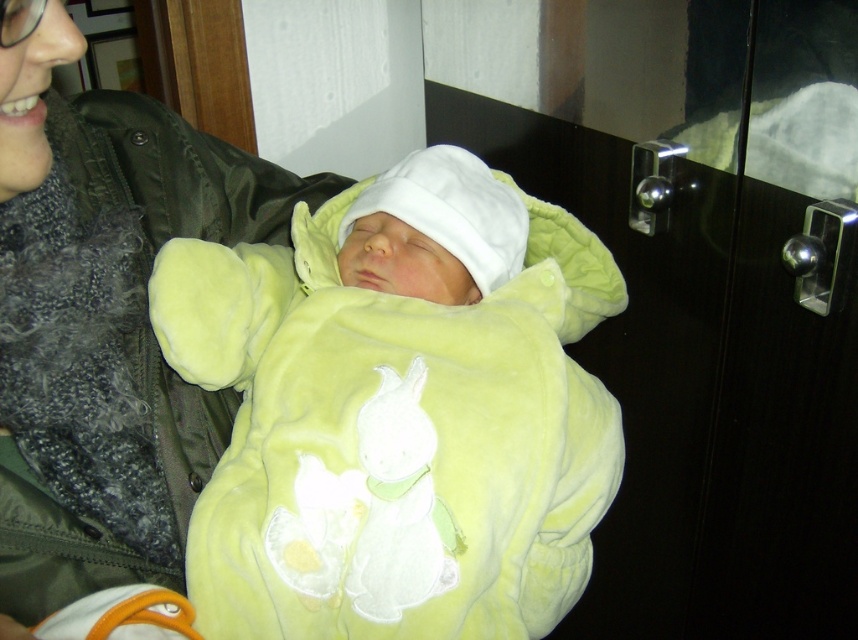
You are a photographer trying to capture a close shot of the baby in the image. Since the velvety yellow onesie at center and the velvet green jacket at upper left are both in the frame, which one should you focus on to ensure the baby is the main subject?

The velvety yellow onesie at center is positioned on the right side of the velvet green jacket at upper left, so focusing on the velvety yellow onesie at center would ensure the baby is the main subject since it is centered and closer to the baby.

You are a photographer trying to capture a close shot of the baby in the velvety yellow onesie at center and the person in the velvet green jacket at upper left. Since the camera can only focus on one subject at a time, which subject should you choose to ensure the baby is fully visible in the frame?

The velvety yellow onesie at center is taller than the velvet green jacket at upper left, so you should focus on the baby in the velvety yellow onesie at center to ensure it is fully visible in the frame.

Consider the image. You are a photographer trying to capture the baby in the center of the image. The baby is wearing a velvety yellow onesie at center. The camera you are using has a focus point at coordinate point (397, 413). Will the focus point align with the baby?

The velvety yellow onesie at center is located at point (397, 413), so yes, the focus point at coordinate point (397, 413) will align with the baby wearing the velvety yellow onesie at center.